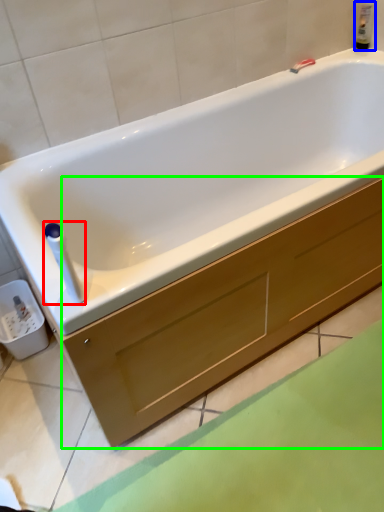
Question: Estimate the real-world distances between objects in this image. Which object is farther from towel bar (highlighted by a red box), bottle (highlighted by a blue box) or drawer (highlighted by a green box)?

Choices:
 (A) bottle
 (B) drawer

Answer: (A)